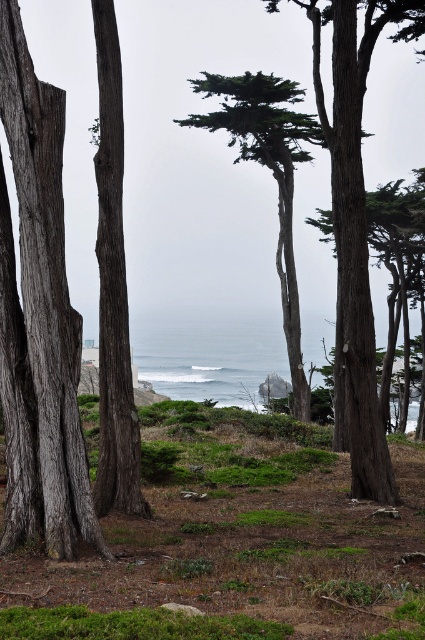
You are standing in the coastal scene and want to take a photo of both the smooth gray bark tree at left and the smooth bark tree at center. Which tree should you position yourself closer to in order to include both in your camera frame?

You should position yourself closer to the smooth gray bark tree at left because it is located below the smooth bark tree at center, allowing both to be captured in the frame when you are nearer to the lower one.

You are standing in the coastal scene and want to walk from the smooth gray bark tree at left to the smooth bark tree at center. Which direction should you move to reach the destination?

You should move to the right to reach the smooth bark tree at center from the smooth gray bark tree at left since the smooth gray bark tree at left is positioned on the left side of smooth bark tree at center.

You are standing in the coastal area and see the gray rough bark tree at left and the smooth gray bark tree at left. Which tree is closer to you?

The gray rough bark tree at left is closer to you because it is in front of the smooth gray bark tree at left.